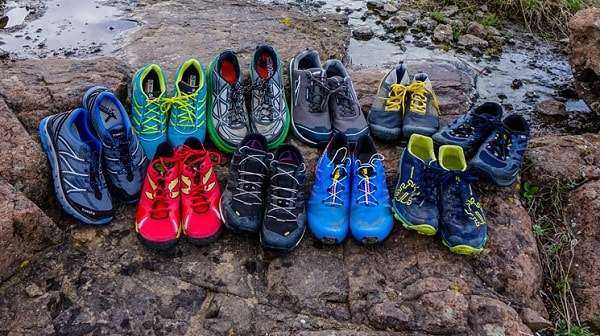
The height and width of the screenshot is (336, 600). Find the location of `pairs of shoes`. pairs of shoes is located at coordinates pos(101,162), pos(166,114), pos(248,100), pos(321,101), pos(401,110), pos(481,139), pos(435,184), pos(345,198), pos(266,191), pos(180,200).